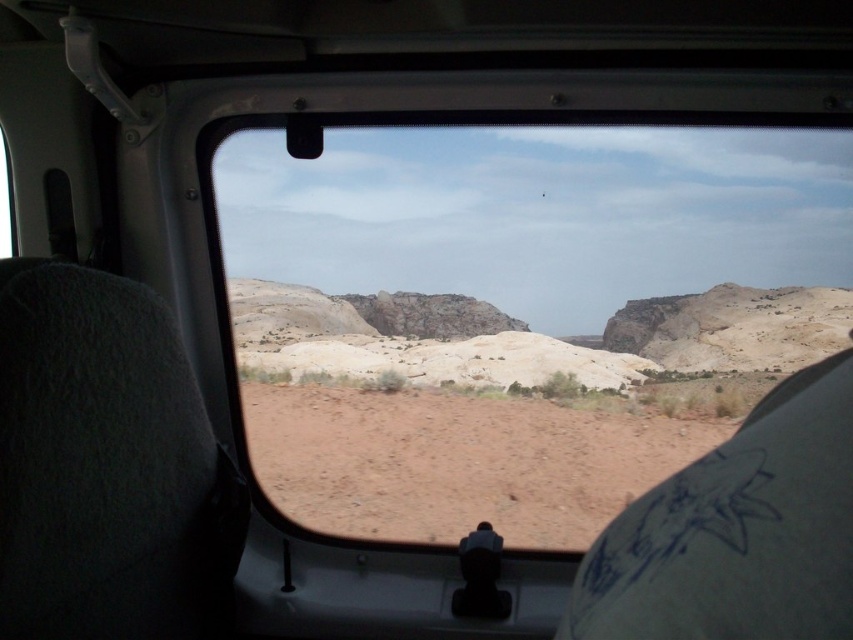
Question: Among these points, which one is farthest from the camera?

Choices:
 (A) pos(372,285)
 (B) pos(514,508)

Answer: (A)

Question: Among these points, which one is farthest from the camera?

Choices:
 (A) (288, 435)
 (B) (664, 468)

Answer: (A)

Question: Does transparent glass window at center come in front of brown sandy dirt at center?

Choices:
 (A) yes
 (B) no

Answer: (A)

Question: Is transparent glass window at center wider than brown sandy dirt at center?

Choices:
 (A) yes
 (B) no

Answer: (A)

Question: Is transparent glass window at center above brown sandy dirt at center?

Choices:
 (A) no
 (B) yes

Answer: (B)